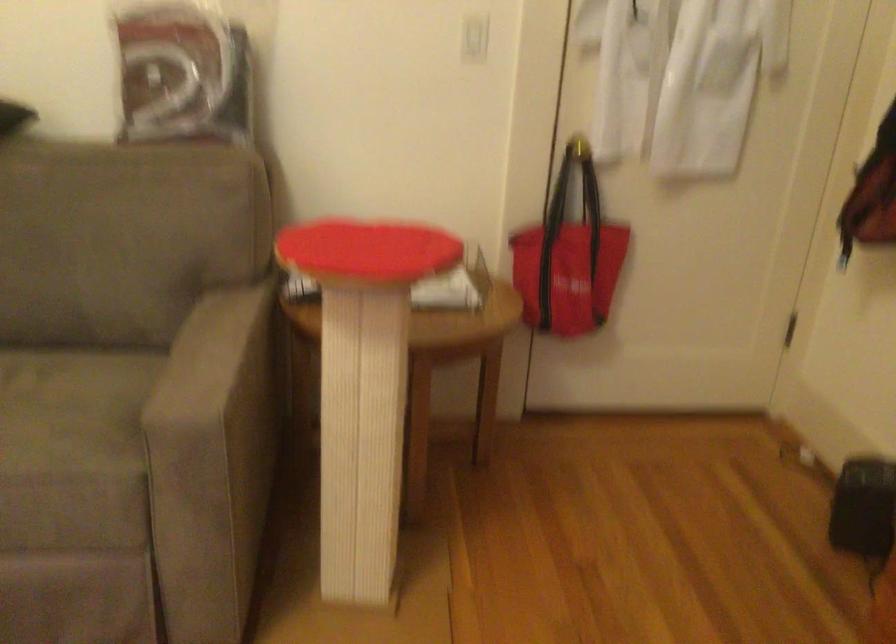
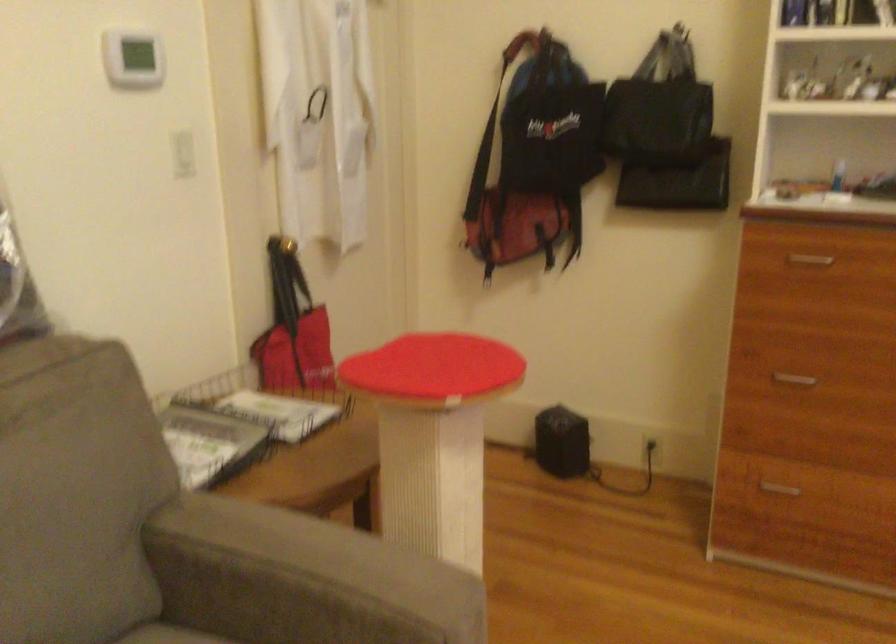
Find the pixel in the second image that matches (x=193, y=353) in the first image.

(302, 579)